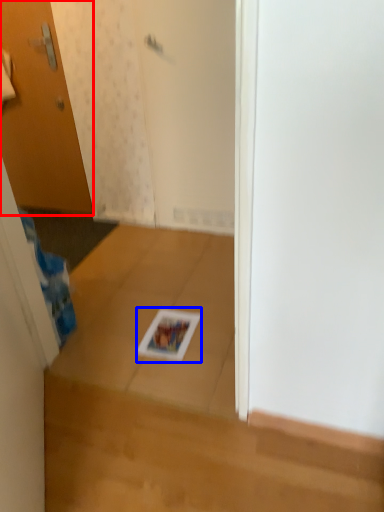
Question: Which point is further to the camera, door (highlighted by a red box) or magazine (highlighted by a blue box)?

Choices:
 (A) door
 (B) magazine

Answer: (A)